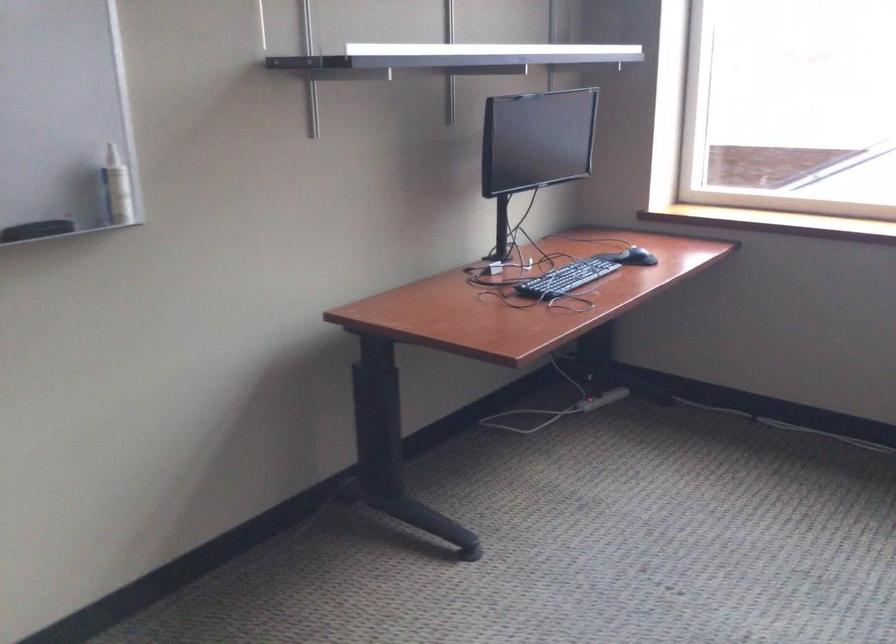
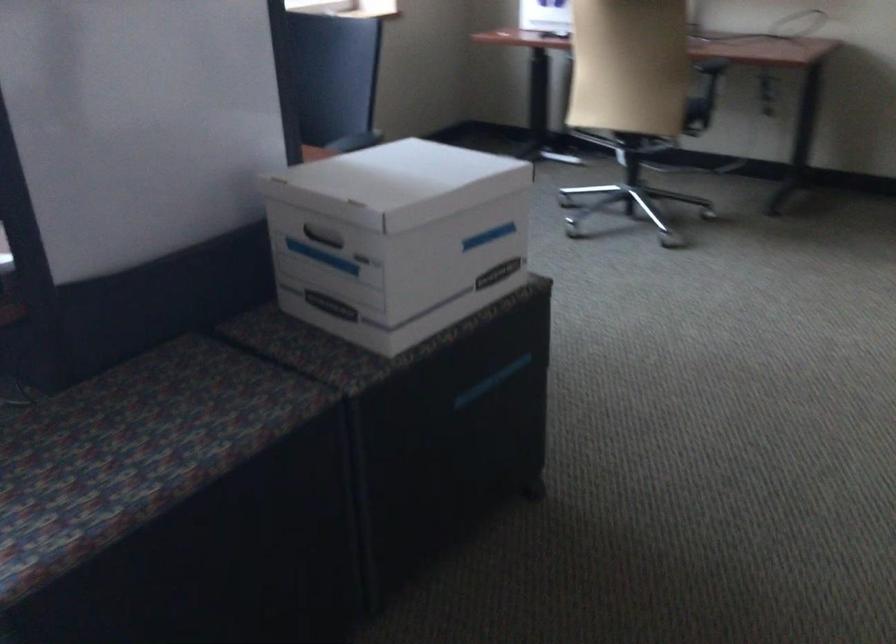
The images are taken continuously from a first-person perspective. In which direction is your viewpoint rotating?

The camera's rotation is toward right-down.